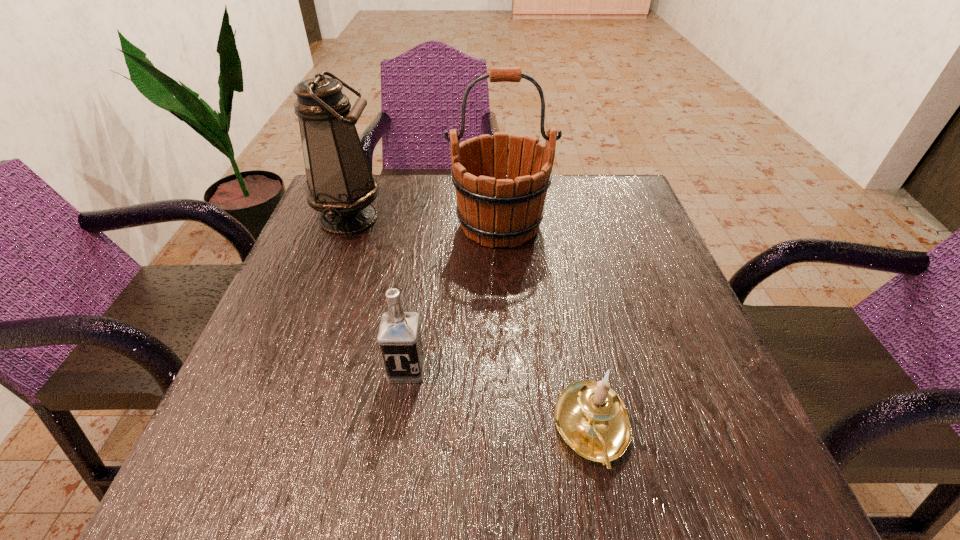
I want to click on free space between the nearest object and the second nearest object, so click(499, 399).

Where is `unoccupied area between the nearest object and the leftmost object`? The image size is (960, 540). unoccupied area between the nearest object and the leftmost object is located at coordinates (470, 323).

The image size is (960, 540). What are the coordinates of `vacant area between the candle holder and the wine bucket` in the screenshot? It's located at (546, 327).

Where is `vacant area that lies between the third object from right to left and the candle holder`? This screenshot has width=960, height=540. vacant area that lies between the third object from right to left and the candle holder is located at coordinates (499, 399).

Locate an element on the screen. free space between the candle holder and the wine bucket is located at coordinates (546, 327).

Identify the location of vacant region between the oil lamp and the wine bucket. (424, 221).

The width and height of the screenshot is (960, 540). What are the coordinates of `vacant area that lies between the wine bucket and the third farthest object` in the screenshot? It's located at (453, 297).

In order to click on vacant point located between the third tallest object and the nearest object in this screenshot , I will do `click(499, 399)`.

I want to click on unoccupied area between the oil lamp and the third object from right to left, so click(377, 293).

Identify the location of vacant area that lies between the third tallest object and the wine bucket. The height and width of the screenshot is (540, 960). (453, 297).